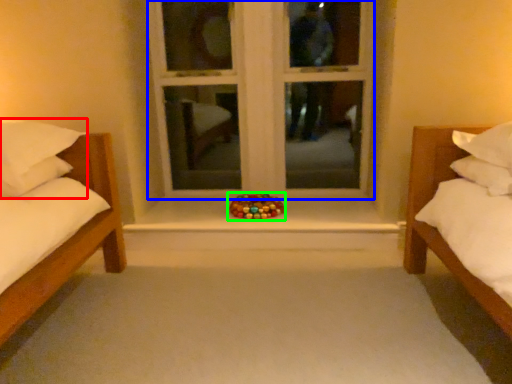
Question: Which object is positioned farthest from pillow (highlighted by a red box)? Select from window frame (highlighted by a blue box) and toy (highlighted by a green box).

Choices:
 (A) window frame
 (B) toy

Answer: (A)